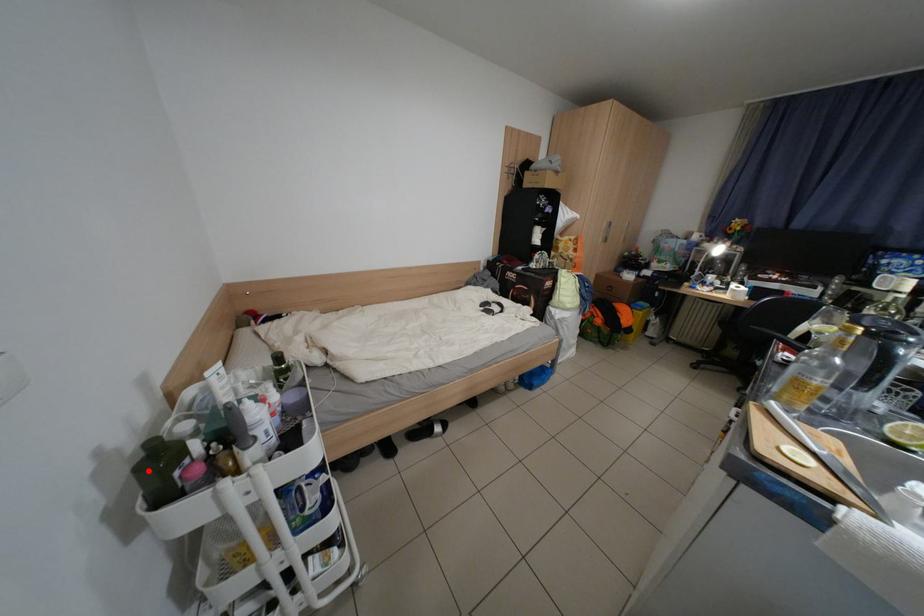
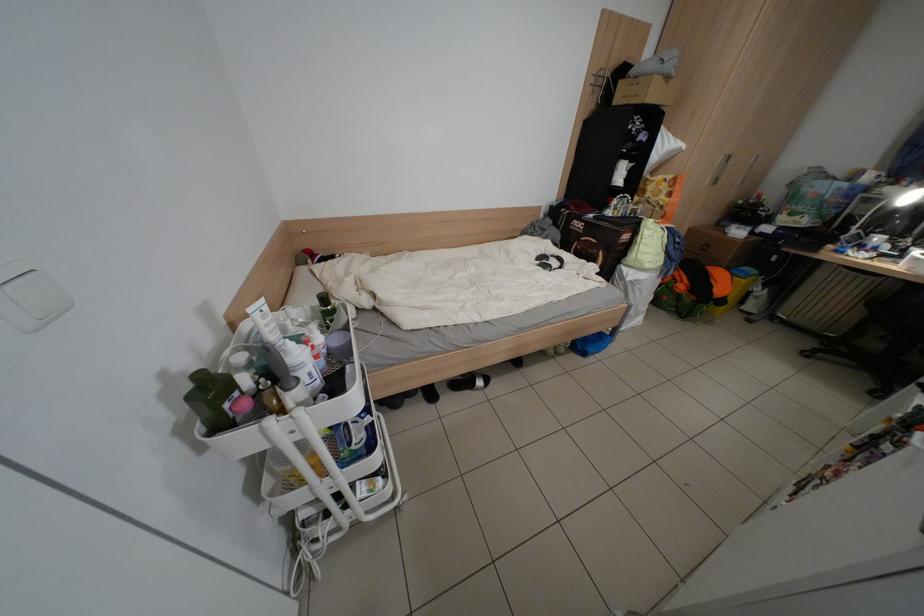
In the second image, find the point that corresponds to the highlighted location in the first image.

(201, 399)